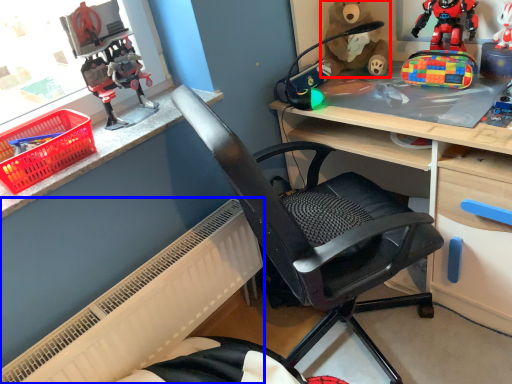
Question: Which object is further to the camera taking this photo, doll (highlighted by a red box) or radiator (highlighted by a blue box)?

Choices:
 (A) doll
 (B) radiator

Answer: (A)